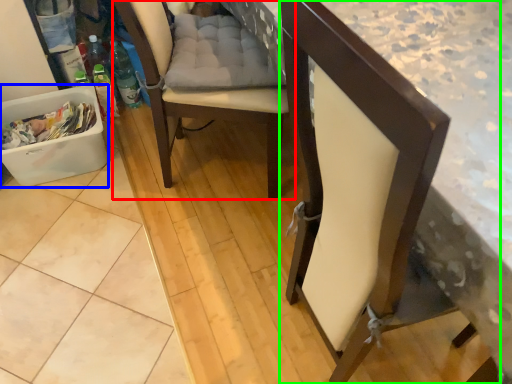
Question: Estimate the real-world distances between objects in this image. Which object is farther from chair (highlighted by a red box), laundry basket (highlighted by a blue box) or chair (highlighted by a green box)?

Choices:
 (A) laundry basket
 (B) chair

Answer: (B)